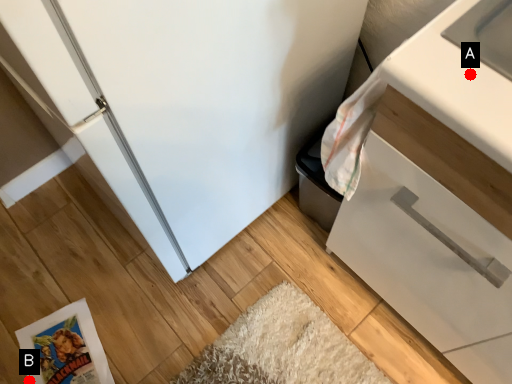
Question: Two points are circled on the image, labeled by A and B beside each circle. Which point is further to the camera?

Choices:
 (A) A is further
 (B) B is further

Answer: (B)